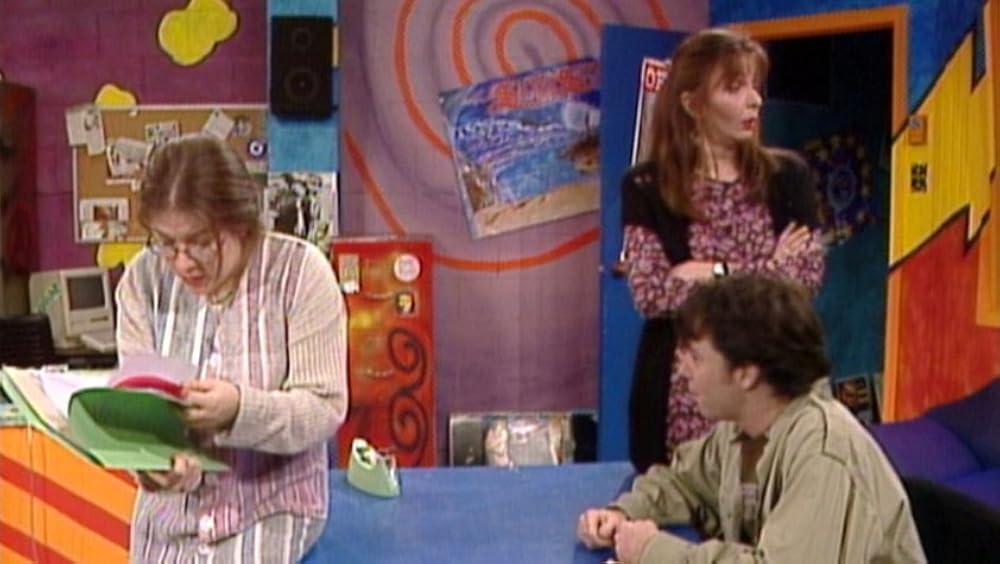
Identify the location of computer. (77, 320).